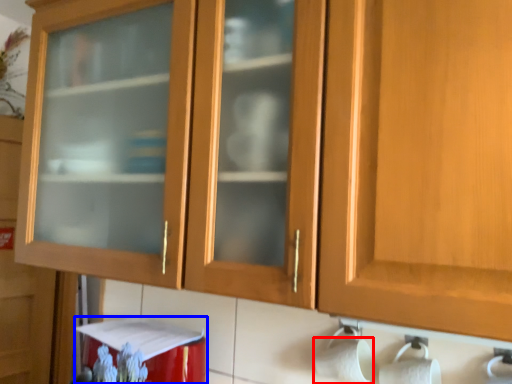
Question: Which object appears farthest to the camera in this image, toilet paper (highlighted by a red box) or appliance (highlighted by a blue box)?

Choices:
 (A) toilet paper
 (B) appliance

Answer: (B)